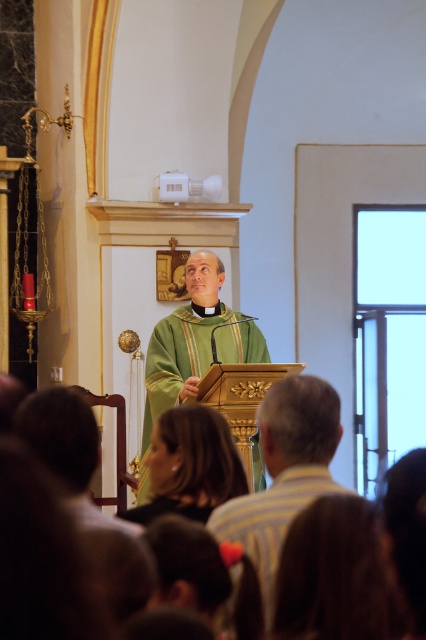
Question: Which of the following is the farthest from the observer?

Choices:
 (A) gold polished lectern at center
 (B) green matte vestment at center

Answer: (B)

Question: Can you confirm if gold polished lectern at center is positioned to the left of green matte vestment at center?

Choices:
 (A) yes
 (B) no

Answer: (B)

Question: Which point is closer to the camera?

Choices:
 (A) (150, 336)
 (B) (282, 396)

Answer: (B)

Question: In this image, where is gold polished lectern at center located relative to green matte vestment at center?

Choices:
 (A) below
 (B) above

Answer: (A)

Question: Is gold polished lectern at center above green matte vestment at center?

Choices:
 (A) yes
 (B) no

Answer: (B)

Question: Among these objects, which one is farthest from the camera?

Choices:
 (A) gold polished lectern at center
 (B) green matte vestment at center

Answer: (B)